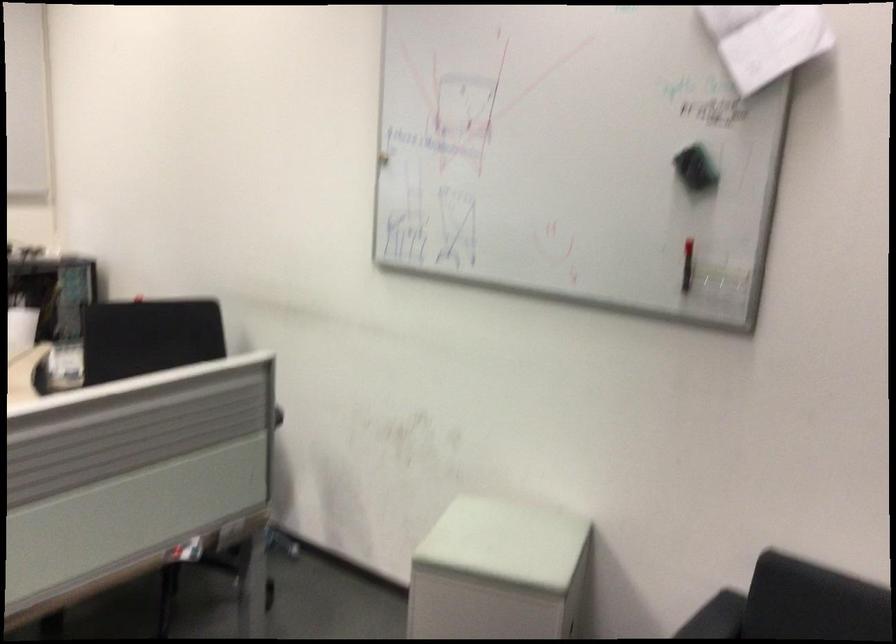
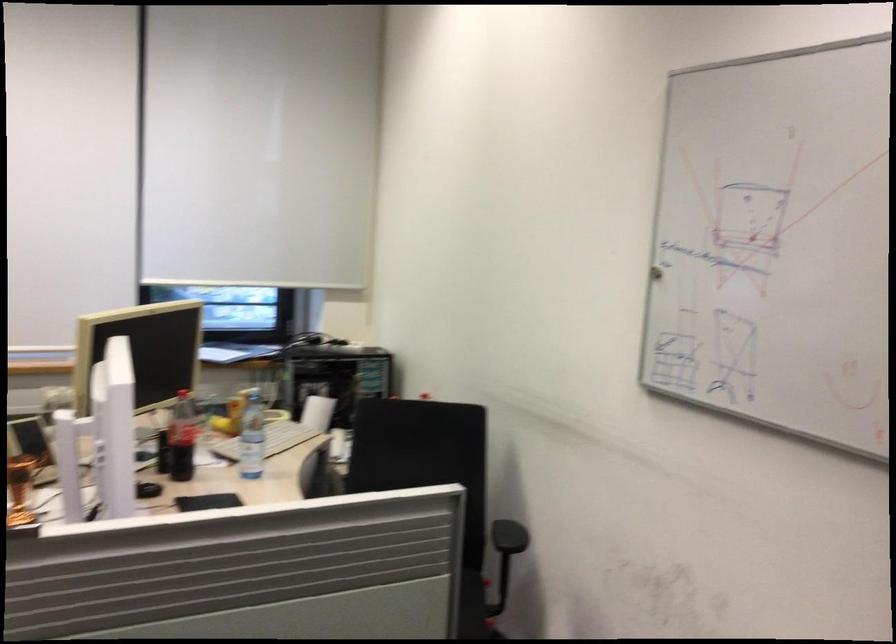
Question: The camera is either moving clockwise (left) or counter-clockwise (right) around the object. The first image is from the beginning of the video and the second image is from the end. Is the camera moving left or right when shooting the video?

Choices:
 (A) Left
 (B) Right

Answer: (B)